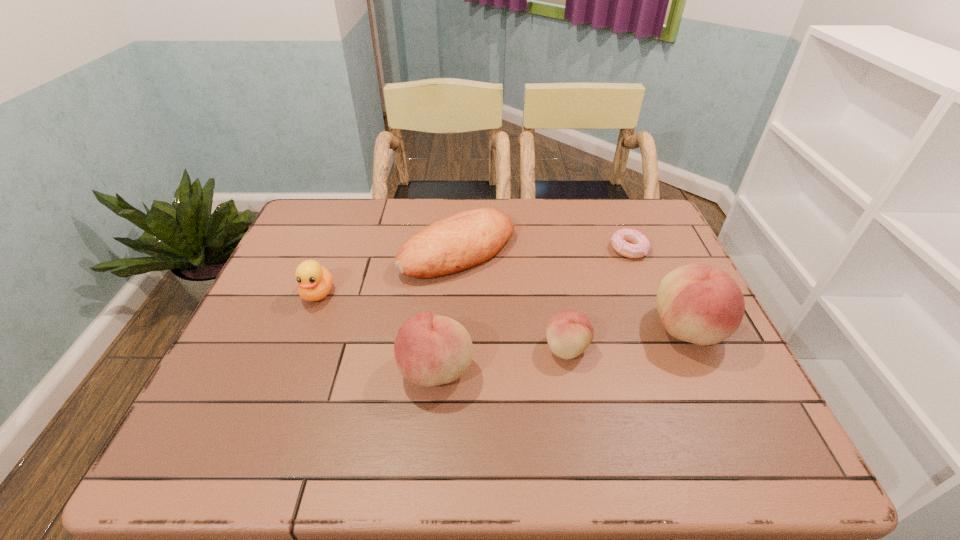
You are a GUI agent. You are given a task and a screenshot of the screen. Output one action in this format:
    pyautogui.click(x=<x>, y=<y>)
    Task: Click on the object positioned at the far right corner
    
    Given the screenshot: What is the action you would take?
    pyautogui.click(x=630, y=243)

Where is `vacant space at the far edge of the desktop`? vacant space at the far edge of the desktop is located at coordinates [363, 204].

I want to click on vacant space at the near edge of the desktop, so click(358, 385).

Locate an element on the screen. This screenshot has width=960, height=540. free space at the left edge of the desktop is located at coordinates (279, 342).

At what (x,y) coordinates should I click in order to perform the action: click on vacant space at the right edge of the desktop. Please return your answer as a coordinate pair (x, y). Image resolution: width=960 pixels, height=540 pixels. Looking at the image, I should click on (683, 363).

Where is `vacant region at the far right corner`? vacant region at the far right corner is located at coordinates (633, 222).

Locate an element on the screen. This screenshot has height=540, width=960. free spot at the near right corner of the desktop is located at coordinates (694, 387).

Find the location of a particular element. This screenshot has height=540, width=960. free space between the duckling and the leftmost peach is located at coordinates (377, 332).

Identify the location of free space between the leftmost peach and the doughnut. The width and height of the screenshot is (960, 540). (533, 309).

The image size is (960, 540). Find the location of `free space between the bread and the leftmost object`. free space between the bread and the leftmost object is located at coordinates (388, 272).